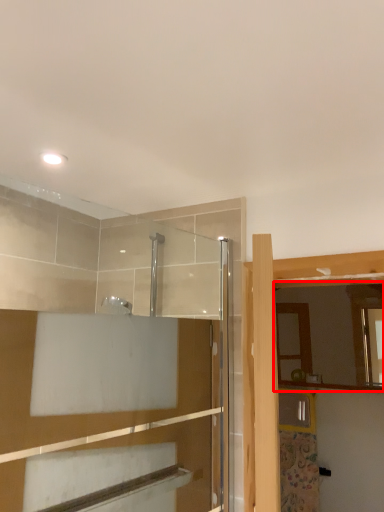
Question: From the image's perspective, considering the relative positions of mirror (annotated by the red box) and screen door in the image provided, where is mirror (annotated by the red box) located with respect to the staircase?

Choices:
 (A) above
 (B) below

Answer: (B)